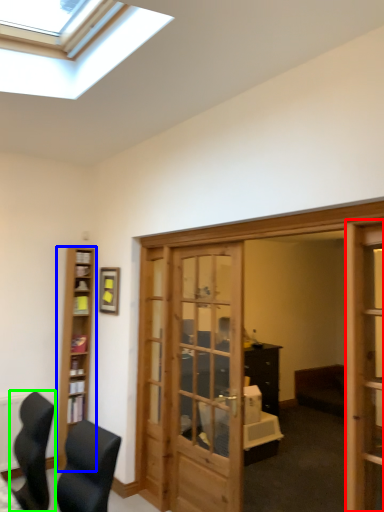
Question: Which object is positioned farthest from screen door (highlighted by a red box)? Select from cabinetry (highlighted by a blue box) and chair (highlighted by a green box).

Choices:
 (A) cabinetry
 (B) chair

Answer: (A)